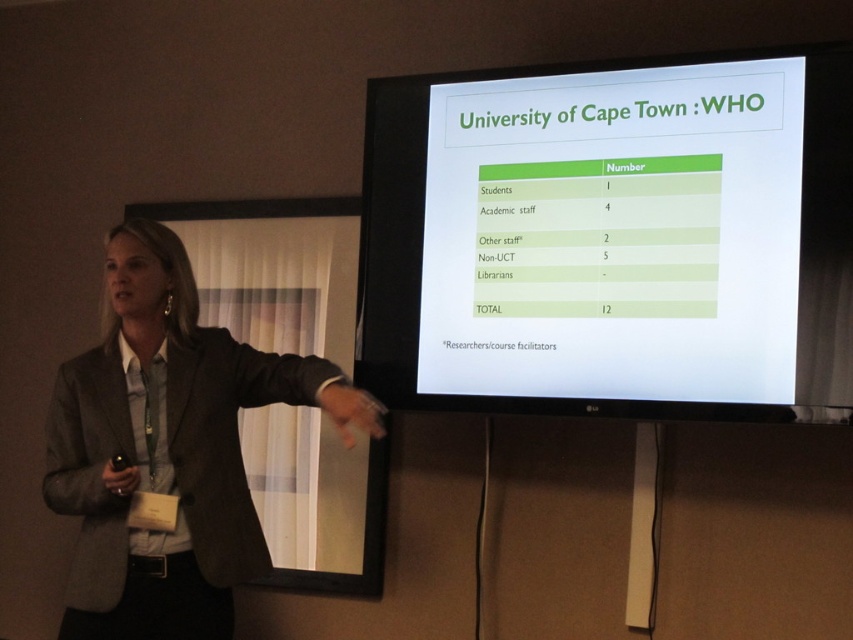
You are attending a presentation and notice the green matte projection screen at upper center and the gray fabric jacket at left. Which object takes up more visual space in the image?

The gray fabric jacket at left takes up more visual space than the green matte projection screen at upper center because the screen occupies less space than the jacket.

You are an attendee at the presentation and need to point to the screen during a question. Since you are standing to the left of the gray fabric jacket at left, can you easily reach the green matte projection screen at upper center with your right hand?

The green matte projection screen at upper center is wider than the gray fabric jacket at left, so yes, you can easily reach it with your right hand while standing to the left of the gray fabric jacket at left.

You are an attendee at a presentation and notice the green matte projection screen at upper center and the gray fabric jacket at left. Which object appears taller in the image?

The gray fabric jacket at left appears taller because the green matte projection screen at upper center is shorter than it.